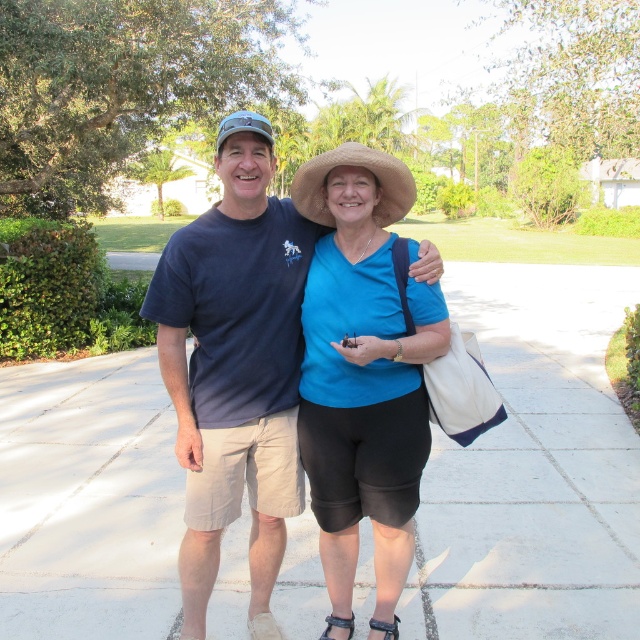
Between white concrete pavement at center and matte blue shirt at center, which one has more height?

matte blue shirt at center is taller.

Who is positioned more to the left, white concrete pavement at center or matte blue shirt at center?

matte blue shirt at center is more to the left.

This screenshot has height=640, width=640. What do you see at coordinates (532, 468) in the screenshot?
I see `white concrete pavement at center` at bounding box center [532, 468].

I want to click on white concrete pavement at center, so click(x=532, y=468).

Which is in front, point (346, 285) or point (380, 164)?

Positioned in front is point (380, 164).

Can you confirm if blue matte shirt at center is shorter than straw hat at center?

Incorrect, blue matte shirt at center's height does not fall short of straw hat at center's.

Measure the distance between blue matte shirt at center and camera.

blue matte shirt at center and camera are 7.95 feet apart from each other.

The width and height of the screenshot is (640, 640). I want to click on blue matte shirt at center, so [x=362, y=376].

This screenshot has height=640, width=640. What do you see at coordinates (236, 365) in the screenshot?
I see `matte blue shirt at center` at bounding box center [236, 365].

Does point (236, 253) come farther from viewer compared to point (392, 173)?

Yes.

Where is `matte blue shirt at center`? Image resolution: width=640 pixels, height=640 pixels. matte blue shirt at center is located at coordinates (236, 365).